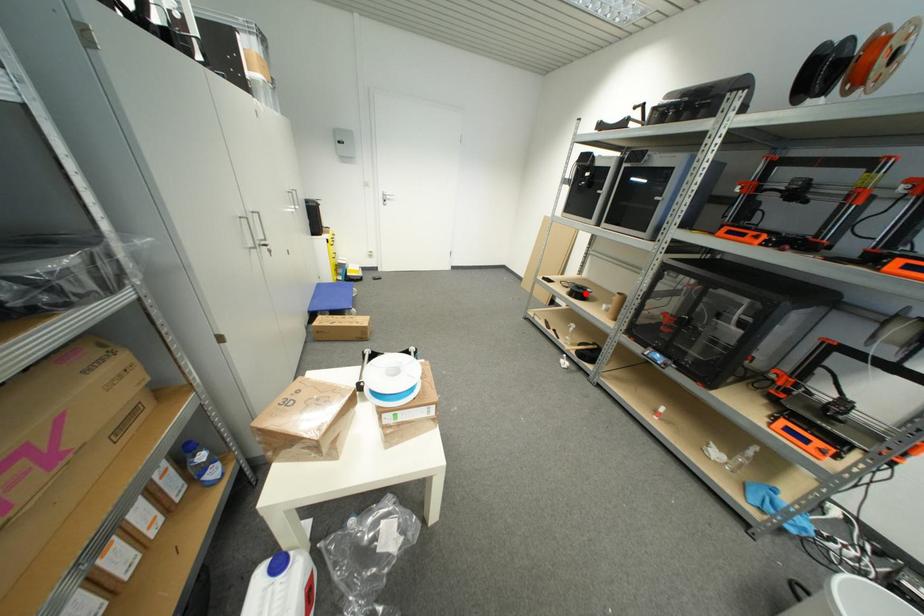
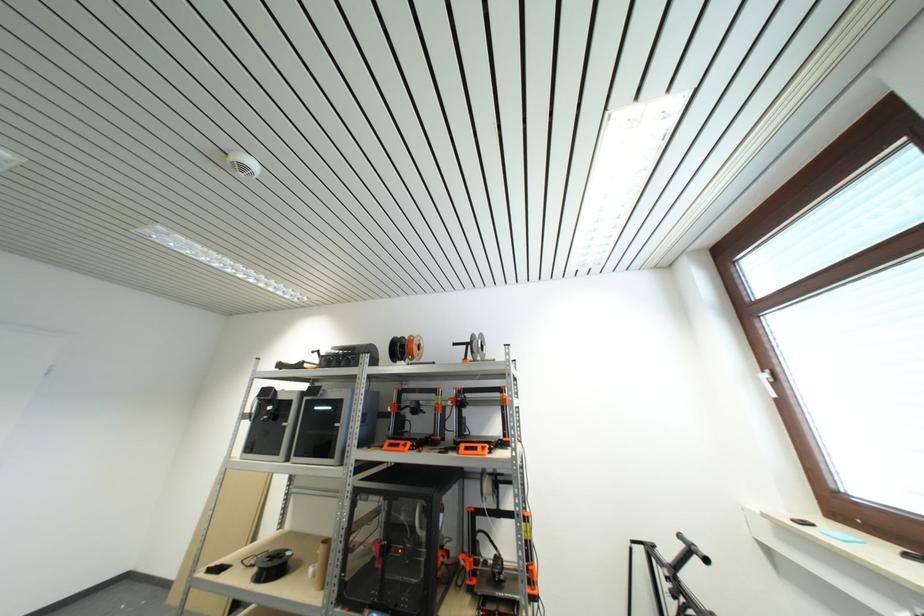
Locate, in the second image, the point that corresponds to the highlighted location in the first image.

(281, 565)